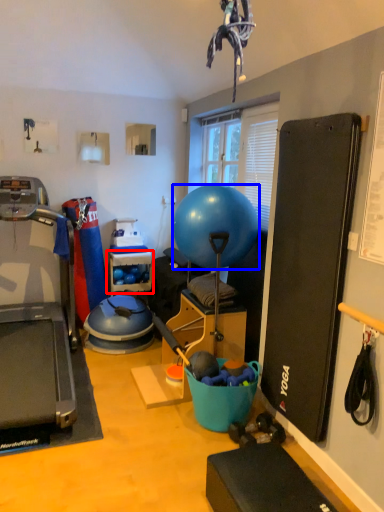
Question: Which of the following is the closest to the observer, shelf (highlighted by a red box) or ball (highlighted by a blue box)?

Choices:
 (A) shelf
 (B) ball

Answer: (B)